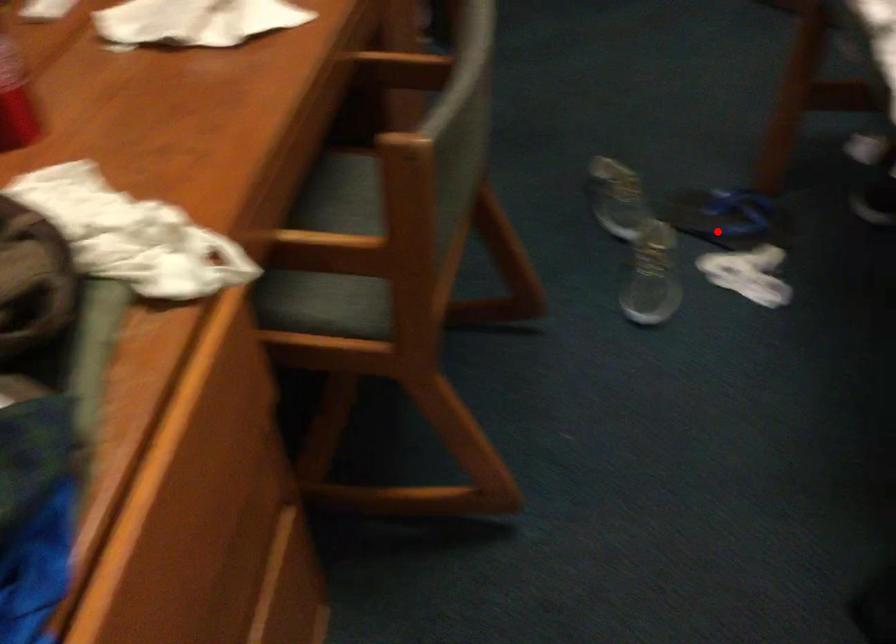
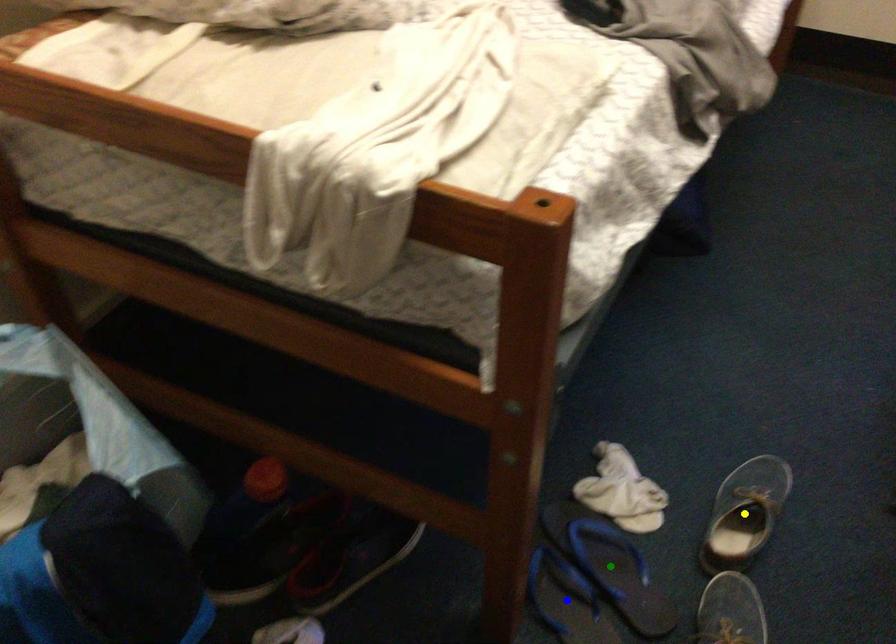
Question: I am providing you with two images of the same scene from different viewpoints. A red point is marked on the first image. You are given multiple points on the second image. Can you choose the point in image 2 that corresponds to the point in image 1?

Choices:
 (A) blue point
 (B) yellow point
 (C) green point

Answer: (C)